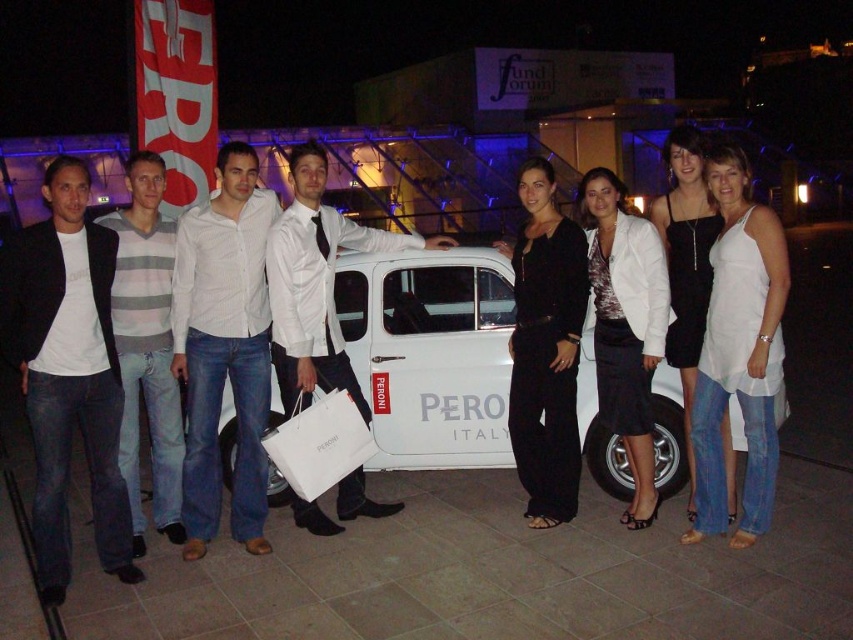
You are a photographer trying to focus on the vintage white car with the PERONI logo. While adjusting your camera, you notice a point at coordinates (x=740, y=349). Based on the scene, what object is this point located on?

The point at coordinates (x=740, y=349) is located on the white cotton tank top at center.

You are a photographer trying to adjust the lighting for the group photo. You notice the gray striped sweater at left and the white textured blazer at center. Which clothing item is narrower in width?

The gray striped sweater at left is narrower in width compared to the white textured blazer at center.

You are a photographer who needs to adjust the lighting between the white cotton tank top at center and the gray striped sweater at left. The lighting equipment can cover a maximum distance of 3 meters. Can you effectively light both subjects without moving the equipment?

The distance between the white cotton tank top at center and the gray striped sweater at left is 3.28 meters, which exceeds the 3 meter coverage of the lighting equipment. Therefore, the equipment cannot effectively light both subjects without moving.